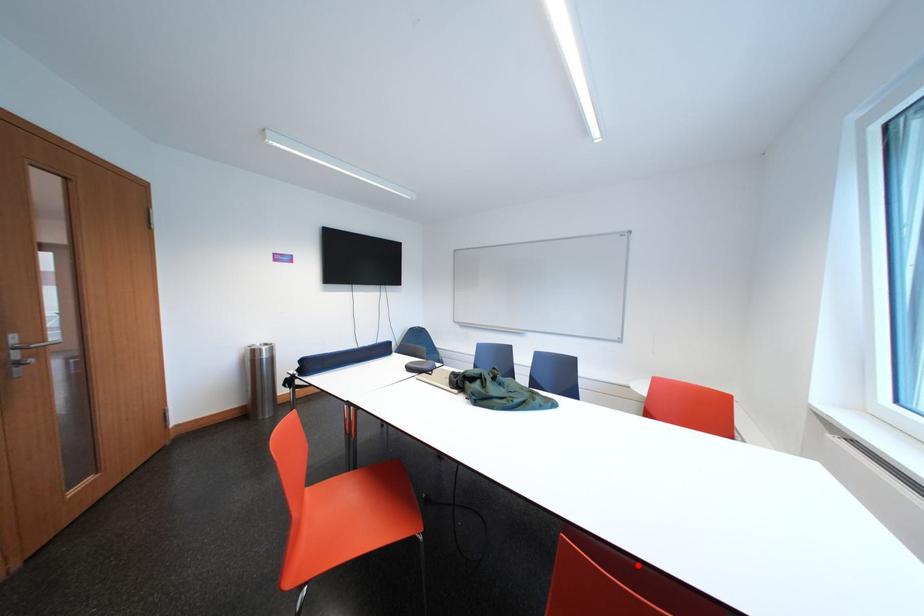
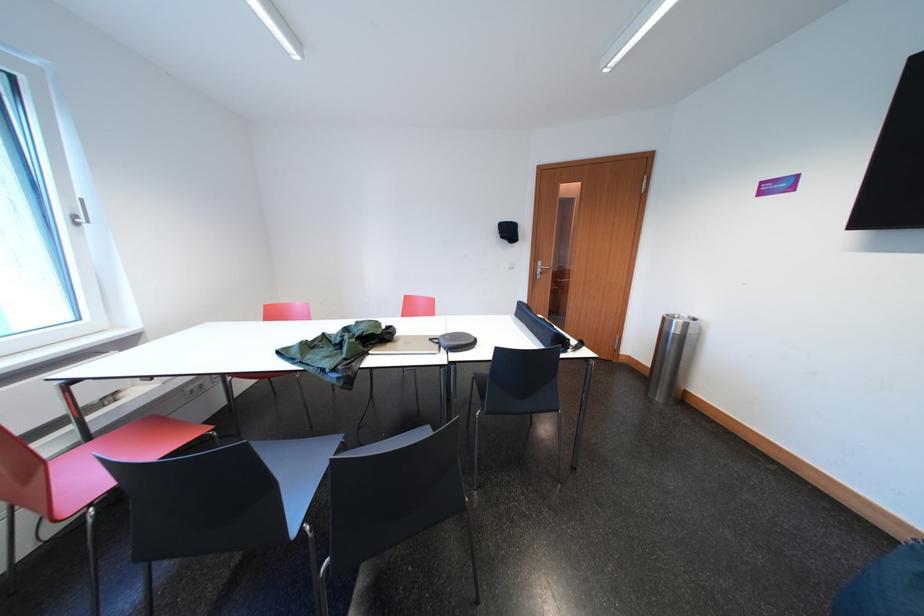
Question: I am providing you with two images of the same scene from different viewpoints. A red point is marked on the first image. Can you still see the location of the red point in image 2?

Choices:
 (A) Yes
 (B) No

Answer: (B)